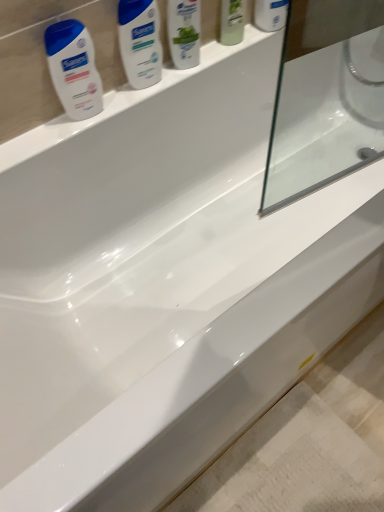
The height and width of the screenshot is (512, 384). Identify the location of vacant area that lies between white glossy shampoo at upper center, which ranks as the 1th cleaning product in right-to-left order, and white glossy mouthwash at upper center, the second mouthwash in the left-to-right sequence. (225, 50).